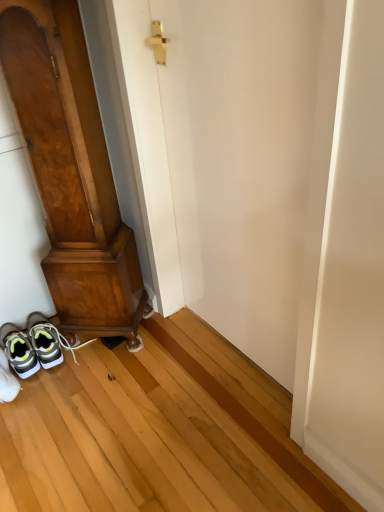
I want to click on free space between white smooth door at center, which ranks as the 1th door in right-to-left order, and white mesh sneakers at lower left, marked as the 2th footwear in a back-to-front arrangement, so click(134, 381).